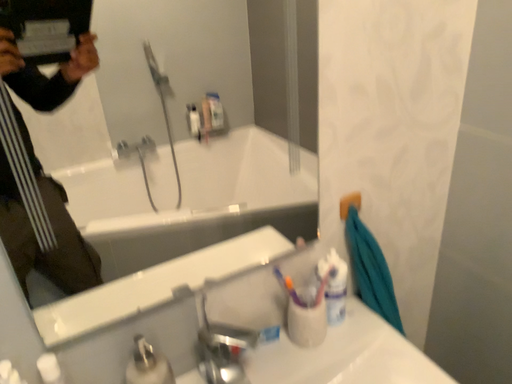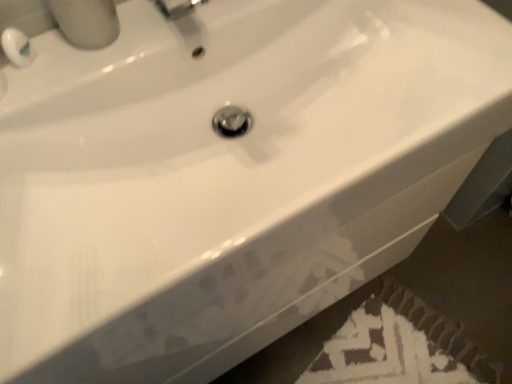
Question: How did the camera likely rotate when shooting the video?

Choices:
 (A) rotated downward
 (B) rotated upward

Answer: (A)